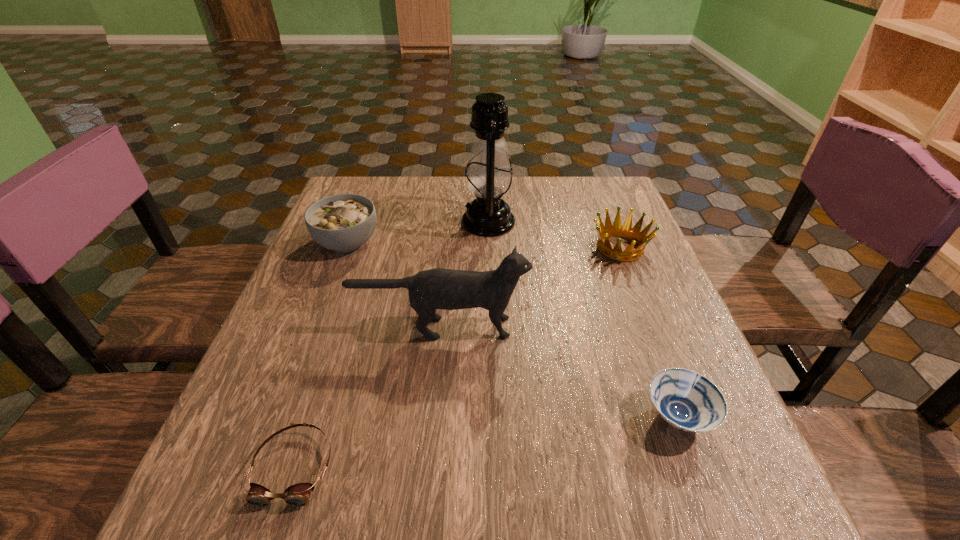
At what (x,y) coordinates should I click in order to perform the action: click on oil lamp. Please return your answer as a coordinate pair (x, y). This screenshot has height=540, width=960. Looking at the image, I should click on (489, 177).

I want to click on cat, so click(x=438, y=288).

The height and width of the screenshot is (540, 960). In order to click on the fourth farthest object in this screenshot , I will do `click(438, 288)`.

I want to click on the third tallest object, so [344, 222].

At what (x,y) coordinates should I click in order to perform the action: click on the taller soup bowl. Please return your answer as a coordinate pair (x, y). Looking at the image, I should click on (344, 222).

At what (x,y) coordinates should I click in order to perform the action: click on crown. Please return your answer as a coordinate pair (x, y). This screenshot has width=960, height=540. Looking at the image, I should click on 634,234.

At what (x,y) coordinates should I click in order to perform the action: click on the nearer soup bowl. Please return your answer as a coordinate pair (x, y). Looking at the image, I should click on (685, 399).

Identify the location of the right soup bowl. The image size is (960, 540). (685, 399).

Where is `the shortest object`? Image resolution: width=960 pixels, height=540 pixels. the shortest object is located at coordinates (298, 495).

Find the location of a particular element. This screenshot has height=540, width=960. free space located 0.370m on the front of the oil lamp is located at coordinates (492, 355).